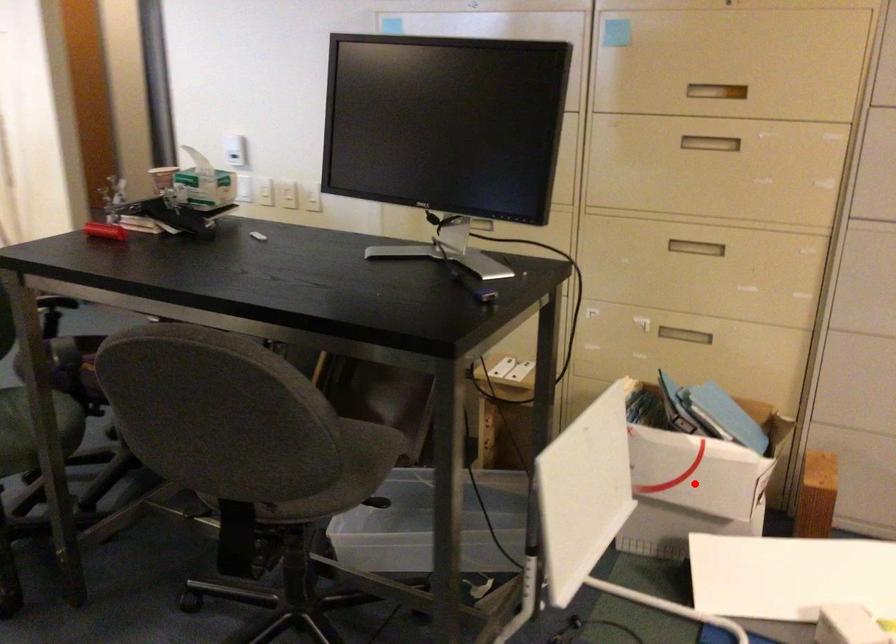
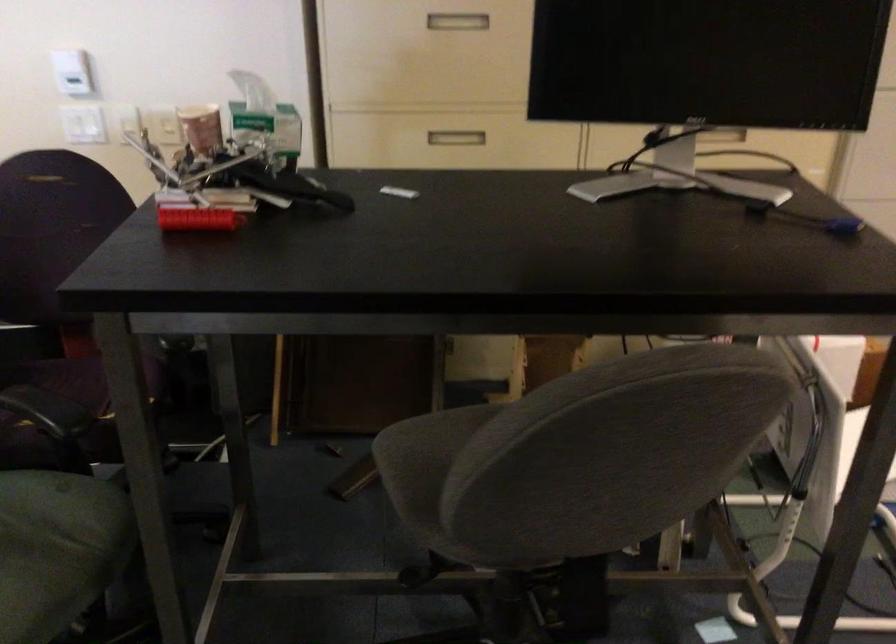
Question: I am providing you with two images of the same scene from different viewpoints. A red point is marked on the first image. Can you still see the location of the red point in image 2?

Choices:
 (A) Yes
 (B) No

Answer: (B)